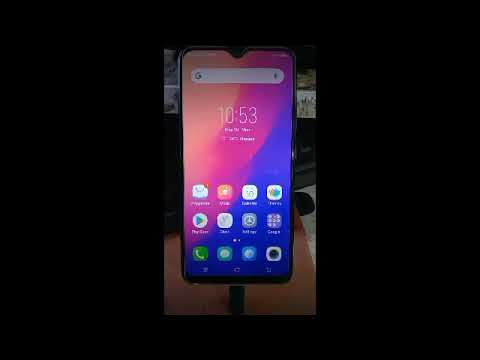
Locate an element on the screen. The width and height of the screenshot is (480, 360). screen is located at coordinates (218, 141).